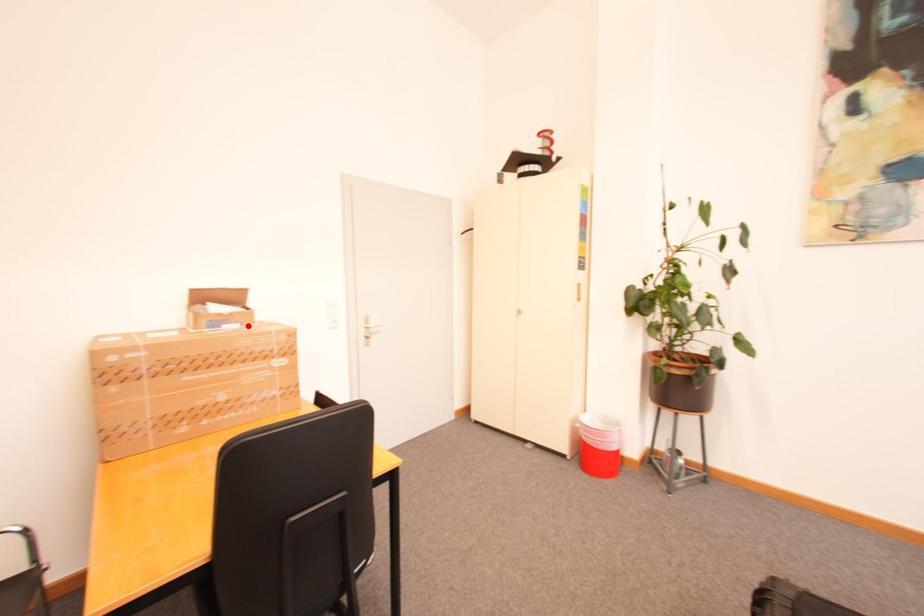
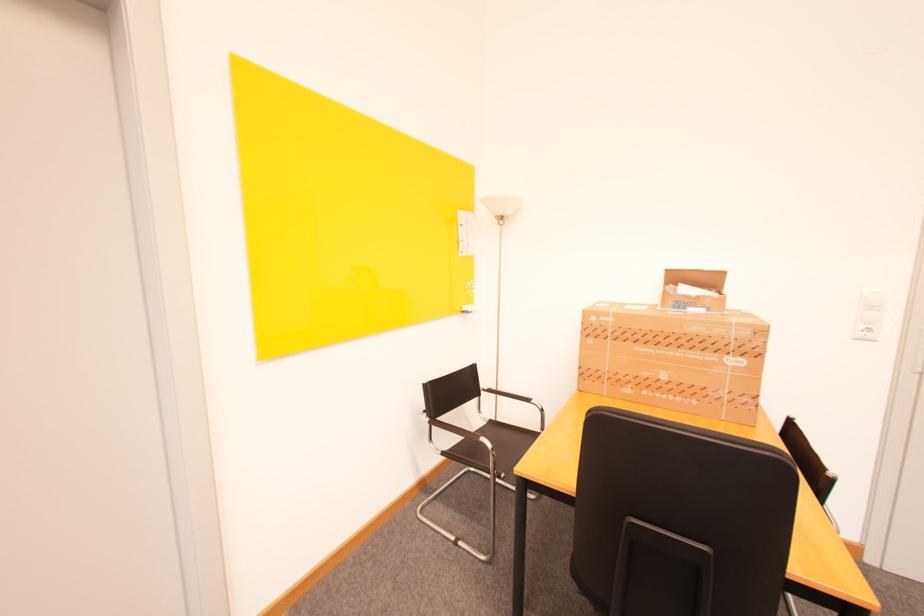
In the second image, find the point that corresponds to the highlighted location in the first image.

(714, 310)